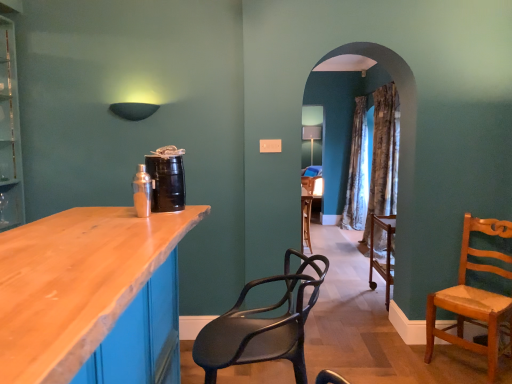
Describe the element at coordinates (384, 156) in the screenshot. I see `patterned fabric curtain at center` at that location.

Find the location of a particular element. light brown wooden chair at right, the 2th chair from the left is located at coordinates (475, 299).

At what (x,y) coordinates should I click in order to perform the action: click on patterned fabric curtain at center. Please return your answer as a coordinate pair (x, y). The height and width of the screenshot is (384, 512). Looking at the image, I should click on (384, 156).

Considering the relative sizes of matte black chair at center, which is counted as the 2th chair, starting from the back, and patterned fabric curtain at center in the image provided, is matte black chair at center, which is counted as the 2th chair, starting from the back, bigger than patterned fabric curtain at center?

Actually, matte black chair at center, which is counted as the 2th chair, starting from the back, might be smaller than patterned fabric curtain at center.

Is matte black chair at center, which is counted as the first chair, starting from the left, not within patterned fabric curtain at center?

Yes.

Is matte black chair at center, the second chair positioned from the right, behind patterned fabric curtain at center?

No, matte black chair at center, the second chair positioned from the right, is closer to the camera.

From the image's perspective, which one is positioned lower, matte black chair at center, which is counted as the first chair, starting from the left, or patterned fabric curtain at center?

matte black chair at center, which is counted as the first chair, starting from the left.

Is matte black chair at center, which is the first chair from front to back, aimed at light brown wooden chair at right, marked as the 1th chair in a right-to-left arrangement?

No, matte black chair at center, which is the first chair from front to back, is not oriented towards light brown wooden chair at right, marked as the 1th chair in a right-to-left arrangement.

Between matte black chair at center, the second chair positioned from the right, and light brown wooden chair at right, the 2th chair from the left, which one has larger size?

With larger size is light brown wooden chair at right, the 2th chair from the left.

Which of these two, matte black chair at center, which is counted as the 2th chair, starting from the back, or light brown wooden chair at right, the 2th chair from the left, is thinner?

light brown wooden chair at right, the 2th chair from the left, is thinner.

Considering the relative positions of patterned fabric curtain at center and matte black chair at center, which is counted as the 2th chair, starting from the back, in the image provided, is patterned fabric curtain at center to the left or to the right of matte black chair at center, which is counted as the 2th chair, starting from the back,?

From the image, it's evident that patterned fabric curtain at center is to the right of matte black chair at center, which is counted as the 2th chair, starting from the back.

Can you tell me how much patterned fabric curtain at center and matte black chair at center, which is counted as the 2th chair, starting from the back, differ in facing direction?

There is a 1.45-degree angle between the facing directions of patterned fabric curtain at center and matte black chair at center, which is counted as the 2th chair, starting from the back.

Looking at the image, does patterned fabric curtain at center seem bigger or smaller compared to matte black chair at center, which is counted as the 2th chair, starting from the back?

In the image, patterned fabric curtain at center appears to be larger than matte black chair at center, which is counted as the 2th chair, starting from the back.

From a real-world perspective, is light brown wooden chair at right, acting as the second chair starting from the front, physically located above or below matte black chair at center, which is counted as the 2th chair, starting from the back?

light brown wooden chair at right, acting as the second chair starting from the front, is situated lower than matte black chair at center, which is counted as the 2th chair, starting from the back, in the real world.

Considering the points (493, 348) and (200, 361), which point is behind, point (493, 348) or point (200, 361)?

The point (493, 348) is behind.

In the image, is light brown wooden chair at right, acting as the second chair starting from the front, positioned in front of or behind matte black chair at center, which is counted as the first chair, starting from the left?

Visually, light brown wooden chair at right, acting as the second chair starting from the front, is located behind matte black chair at center, which is counted as the first chair, starting from the left.

From the image's perspective, is light brown wooden chair at right, acting as the second chair starting from the front, over matte black chair at center, the second chair positioned from the right?

Answer: No.

Could you tell me if patterned fabric curtain at center is facing light brown wooden chair at right, marked as the 1th chair in a right-to-left arrangement?

No.

From their relative heights in the image, would you say patterned fabric curtain at center is taller or shorter than light brown wooden chair at right, acting as the second chair starting from the front?

Considering their sizes, patterned fabric curtain at center has more height than light brown wooden chair at right, acting as the second chair starting from the front.

From the image's perspective, is patterned fabric curtain at center over light brown wooden chair at right, arranged as the 1th chair when viewed from the back?

Yes, from the image's perspective, patterned fabric curtain at center is over light brown wooden chair at right, arranged as the 1th chair when viewed from the back.

Is the surface of light brown wooden chair at right, the 2th chair from the left, in direct contact with patterned fabric curtain at center?

No, light brown wooden chair at right, the 2th chair from the left, is not in contact with patterned fabric curtain at center.

Is the depth of light brown wooden chair at right, the 2th chair from the left, greater than that of patterned fabric curtain at center?

No.

From a real-world perspective, who is located lower, light brown wooden chair at right, acting as the second chair starting from the front, or patterned fabric curtain at center?

In real-world perspective, light brown wooden chair at right, acting as the second chair starting from the front, is lower.

From the image's perspective, is light brown wooden chair at right, arranged as the 1th chair when viewed from the back, located above patterned fabric curtain at center?

No, from the image's perspective, light brown wooden chair at right, arranged as the 1th chair when viewed from the back, is not on top of patterned fabric curtain at center.

Locate an element on the screen. curtain to the right of matte black chair at center, which is the first chair from front to back is located at coordinates click(384, 156).

Locate an element on the screen. The height and width of the screenshot is (384, 512). chair above the light brown wooden chair at right, acting as the second chair starting from the front (from the image's perspective) is located at coordinates [x=262, y=326].

When comparing their distances from patterned fabric curtain at center, does light brown wooden chair at right, acting as the second chair starting from the front, or matte black chair at center, which is counted as the first chair, starting from the left, seem further?

The object further to patterned fabric curtain at center is matte black chair at center, which is counted as the first chair, starting from the left.

Looking at the image, which one is located further to matte black chair at center, which is counted as the first chair, starting from the left, patterned fabric curtain at center or light brown wooden chair at right, marked as the 1th chair in a right-to-left arrangement?

patterned fabric curtain at center.

Looking at the image, which one is located further to light brown wooden chair at right, marked as the 1th chair in a right-to-left arrangement, patterned fabric curtain at center or matte black chair at center, which is the first chair from front to back?

Among the two, patterned fabric curtain at center is located further to light brown wooden chair at right, marked as the 1th chair in a right-to-left arrangement.

When comparing their distances from patterned fabric curtain at center, does matte black chair at center, which is the first chair from front to back, or light brown wooden chair at right, arranged as the 1th chair when viewed from the back, seem further?

matte black chair at center, which is the first chair from front to back, is positioned further to the anchor patterned fabric curtain at center.

When comparing their distances from matte black chair at center, which is counted as the 2th chair, starting from the back, does light brown wooden chair at right, the 2th chair from the left, or patterned fabric curtain at center seem further?

patterned fabric curtain at center is further to matte black chair at center, which is counted as the 2th chair, starting from the back.

Estimate the real-world distances between objects in this image. Which object is further from light brown wooden chair at right, arranged as the 1th chair when viewed from the back, matte black chair at center, which is counted as the 2th chair, starting from the back, or patterned fabric curtain at center?

patterned fabric curtain at center lies further to light brown wooden chair at right, arranged as the 1th chair when viewed from the back, than the other object.

Where is `chair between matte black chair at center, the second chair positioned from the right, and patterned fabric curtain at center from front to back`? This screenshot has height=384, width=512. chair between matte black chair at center, the second chair positioned from the right, and patterned fabric curtain at center from front to back is located at coordinates (475, 299).